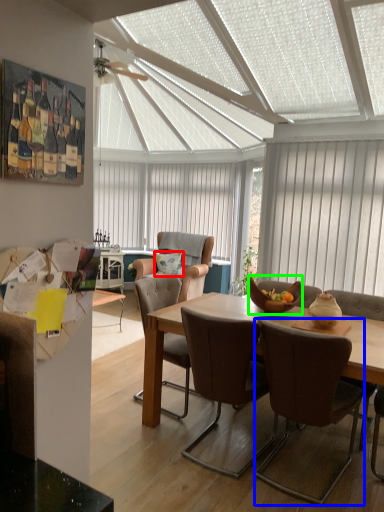
Question: Which object is the farthest from pillow (highlighted by a red box)? Choose among these: chair (highlighted by a blue box) or bowl (highlighted by a green box).

Choices:
 (A) chair
 (B) bowl

Answer: (A)